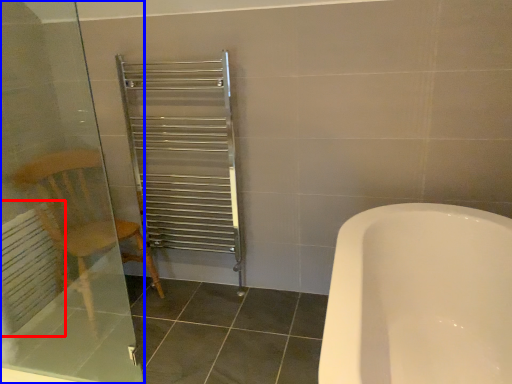
Question: Which of the following is the closest to the observer, radiator (highlighted by a red box) or screen door (highlighted by a blue box)?

Choices:
 (A) radiator
 (B) screen door

Answer: (B)